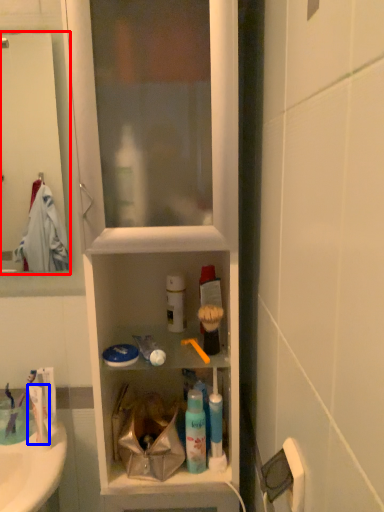
Question: Which object is closer to the camera taking this photo, screen door (highlighted by a red box) or toothpaste (highlighted by a blue box)?

Choices:
 (A) screen door
 (B) toothpaste

Answer: (A)